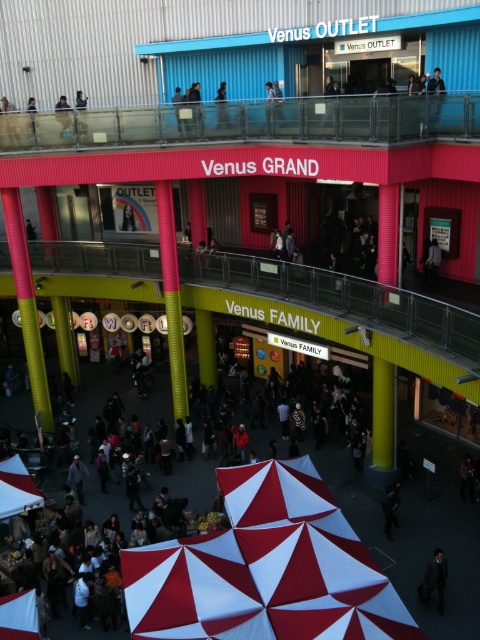
Question: Is red and white fabric canopy at center to the left of dark gray suit at lower right from the viewer's perspective?

Choices:
 (A) no
 (B) yes

Answer: (B)

Question: Which of the following is the closest to the observer?

Choices:
 (A) (200, 620)
 (B) (432, 570)

Answer: (A)

Question: Is red and white fabric canopy at center to the right of dark gray suit at lower right from the viewer's perspective?

Choices:
 (A) no
 (B) yes

Answer: (A)

Question: Does red and white fabric canopy at center appear over dark gray suit at lower right?

Choices:
 (A) yes
 (B) no

Answer: (A)